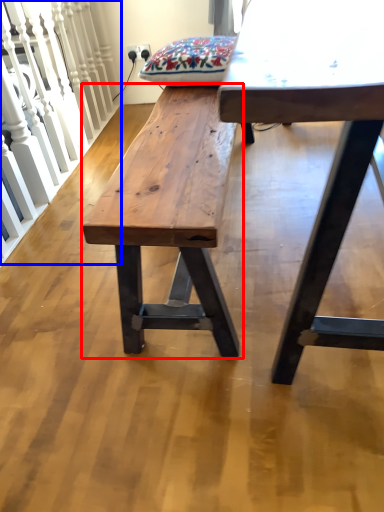
Question: Which object is closer to the camera taking this photo, bench (highlighted by a red box) or rail (highlighted by a blue box)?

Choices:
 (A) bench
 (B) rail

Answer: (A)